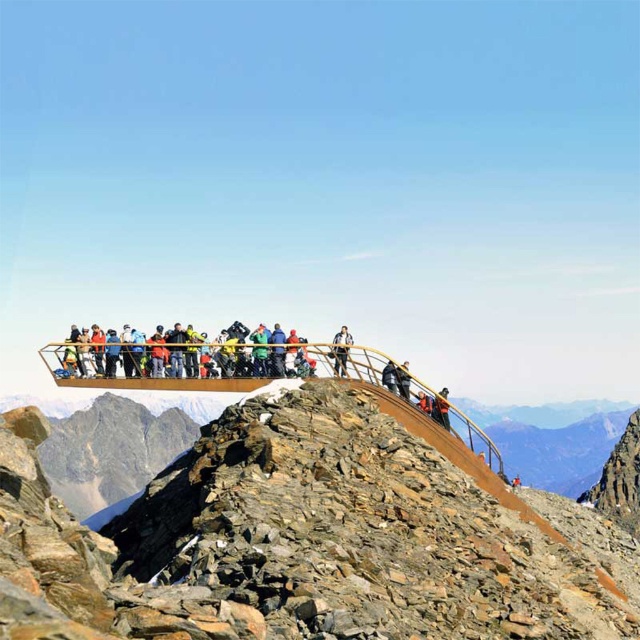
You are a photographer planning to take a group photo of the dark blue jacket at center and the dark gray fabric jacket at center. Which jacket should you position closer to the camera to ensure both appear equally sized in the photo?

To make both the dark blue jacket at center and the dark gray fabric jacket at center appear equally sized in the photo, you should position the dark blue jacket at center closer to the camera since it is smaller in size compared to the dark gray fabric jacket at center.

You are a hiker who just arrived at the mountain peak structure. You see a point marked at coordinates (440,408). Which object is this point located on?

The point marked at coordinates (440,408) is located on the orange life vest at center.